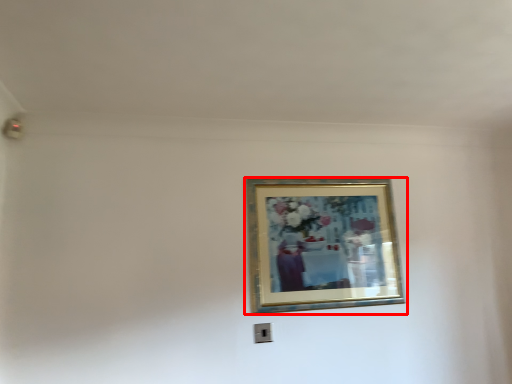
Question: Observing the image, what is the correct spatial positioning of picture frame (annotated by the red box) in reference to electric outlet?

Choices:
 (A) right
 (B) left

Answer: (A)